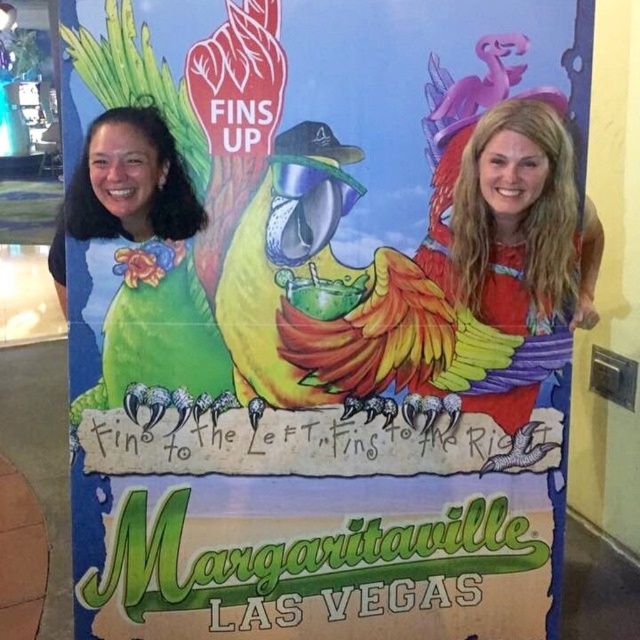
You are a photographer at Margaritaville Las Vegas. You need to adjust the camera focus so that both the blonde hair at right and the green matte parrot at left are clearly visible. Which object should you focus on first to ensure proper depth of field?

The photographer should focus on the green matte parrot at left first because it is larger than the blonde hair at right, allowing for better depth of field adjustment.

Based on the scene description, where is the blonde hair at right located in the image?

The blonde hair at right is located at the 2D coordinates point (518,224).